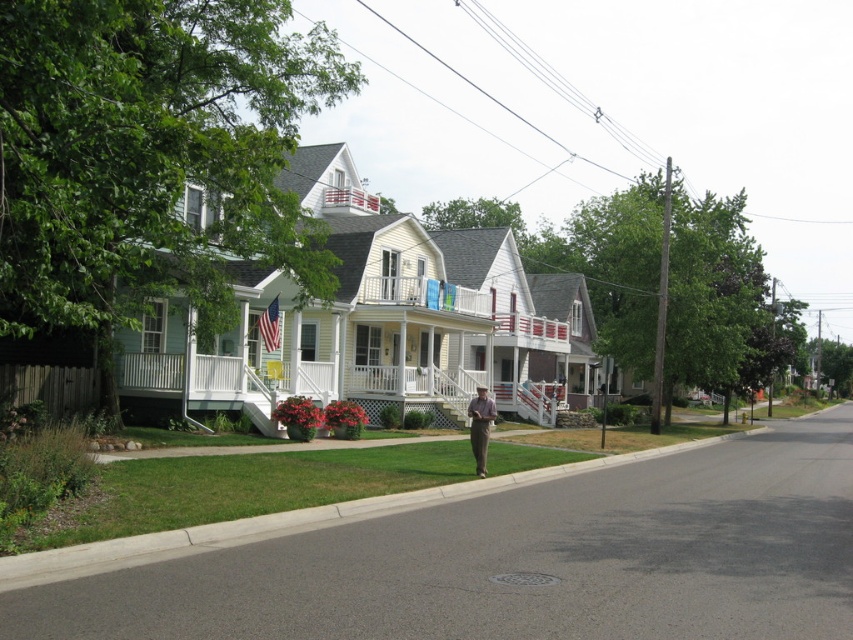
You are a delivery person standing on the sidewalk and see the gray concrete curb at lower center and the light brown pants at center. Which object is located to the right of the other?

The gray concrete curb at lower center is to the right of light brown pants at center according to the description.

You are standing at the camera position observing the suburban street scene. There are two points marked in the image, one at point (x=253, y=534) and the other at point (x=482, y=419). Which of these two points is nearer to your current position?

Point (x=253, y=534) is closer to the camera than point (x=482, y=419), so the point at (x=253, y=534) is nearer to your current position.

You are standing at the edge of the suburban street scene, looking towards the houses. Where is the gray concrete curb at lower center positioned in relation to the houses?

The gray concrete curb at lower center is positioned at point coordinates 0.814 on the x axis and 0.343 on the y axis, which places it near the lower central part of the scene, between the two houses on the street.